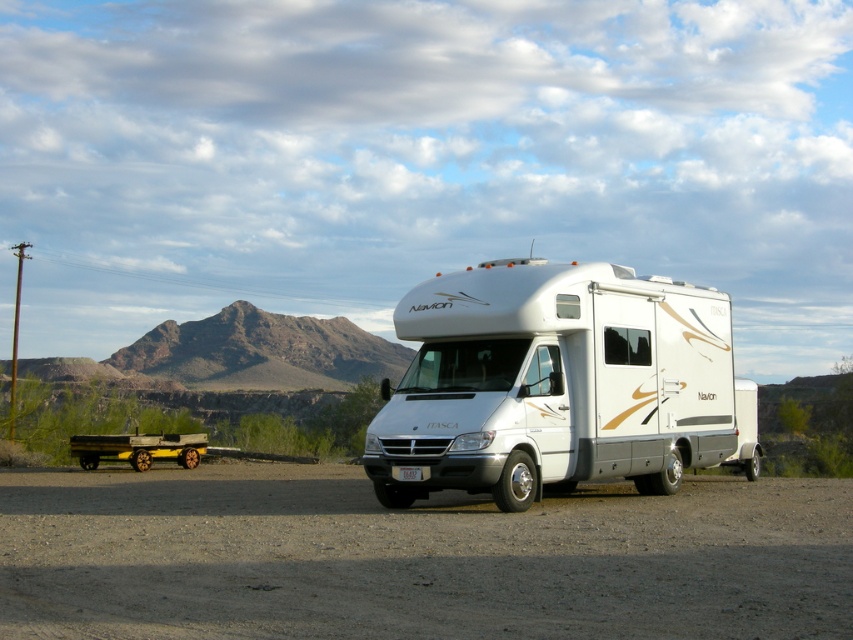
Does point (398, 451) come closer to viewer compared to point (73, 442)?

That is True.

Is white glossy recreational vehicle at center smaller than wooden planks at lower left?

Actually, white glossy recreational vehicle at center might be larger than wooden planks at lower left.

The height and width of the screenshot is (640, 853). What are the coordinates of `white glossy recreational vehicle at center` in the screenshot? It's located at (560, 385).

Does point (245, 467) come closer to viewer compared to point (624, 344)?

No.

Who is lower down, gray gravel dirt track at center or white glossy recreational vehicle at center?

gray gravel dirt track at center

Measure the distance between point (65, 563) and camera.

They are 32.71 feet apart.

Locate an element on the screen. gray gravel dirt track at center is located at coordinates (415, 557).

Who is lower down, gray gravel dirt track at center or wooden planks at lower left?

wooden planks at lower left is lower down.

Is gray gravel dirt track at center positioned at the back of wooden planks at lower left?

No, it is not.

Is point (543, 580) farther from viewer compared to point (115, 456)?

No, (543, 580) is in front of (115, 456).

Find the location of a particular element. This screenshot has height=640, width=853. gray gravel dirt track at center is located at coordinates (415, 557).